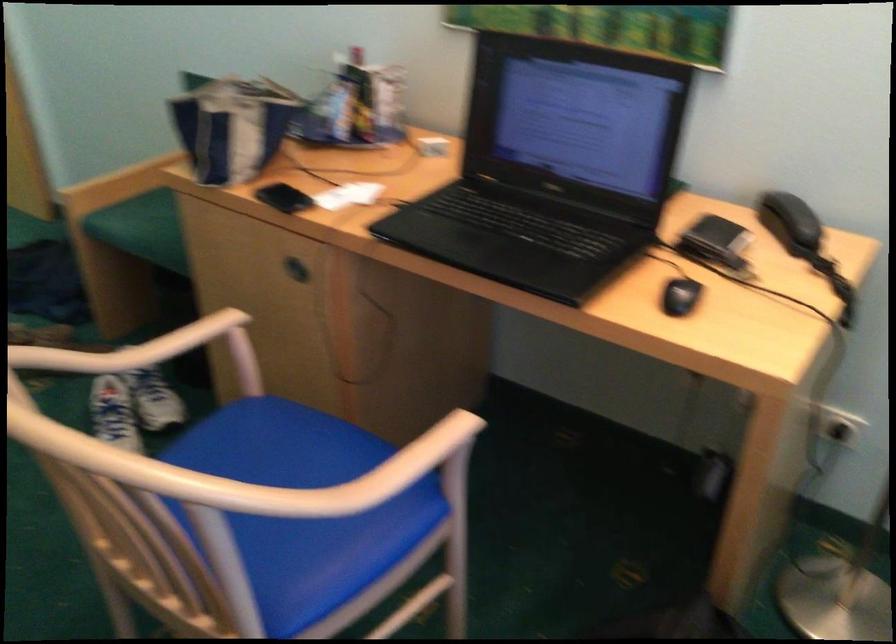
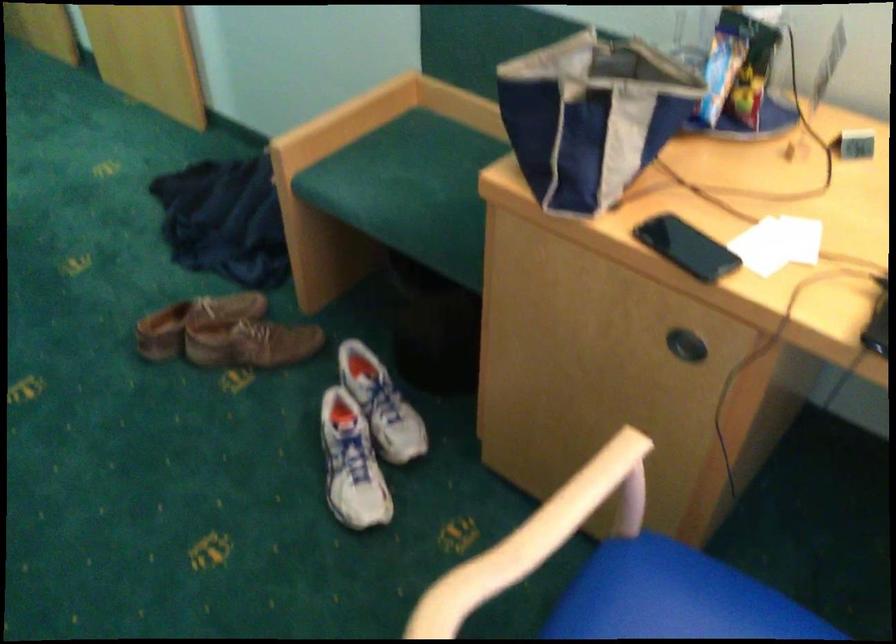
Question: How did the camera likely rotate?

Choices:
 (A) Left
 (B) Right
 (C) Up
 (D) Down

Answer: (D)